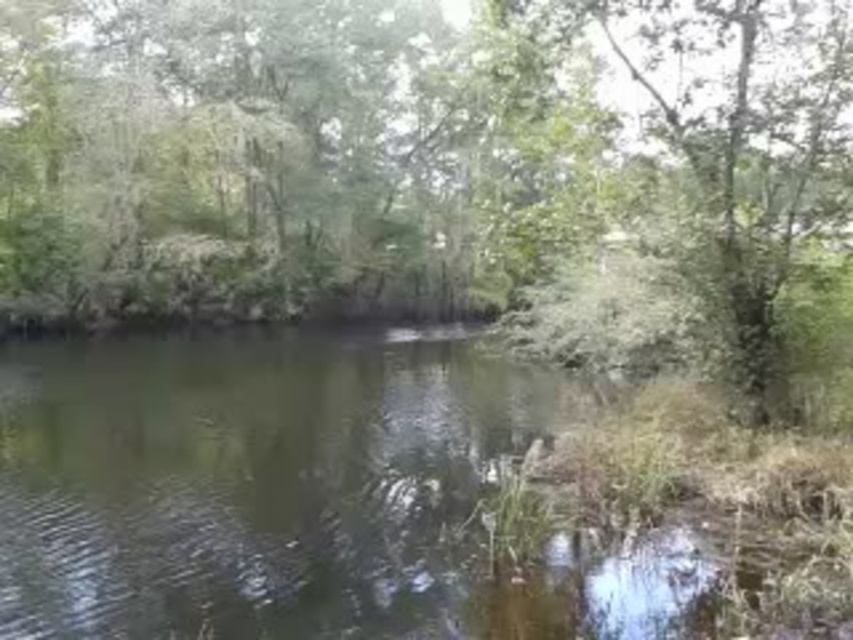
Who is shorter, green leafy tree at center or green grassy river at center?

Standing shorter between the two is green grassy river at center.

Between green leafy tree at center and green grassy river at center, which one appears on the left side from the viewer's perspective?

Positioned to the left is green leafy tree at center.

The height and width of the screenshot is (640, 853). I want to click on green leafy tree at center, so click(439, 173).